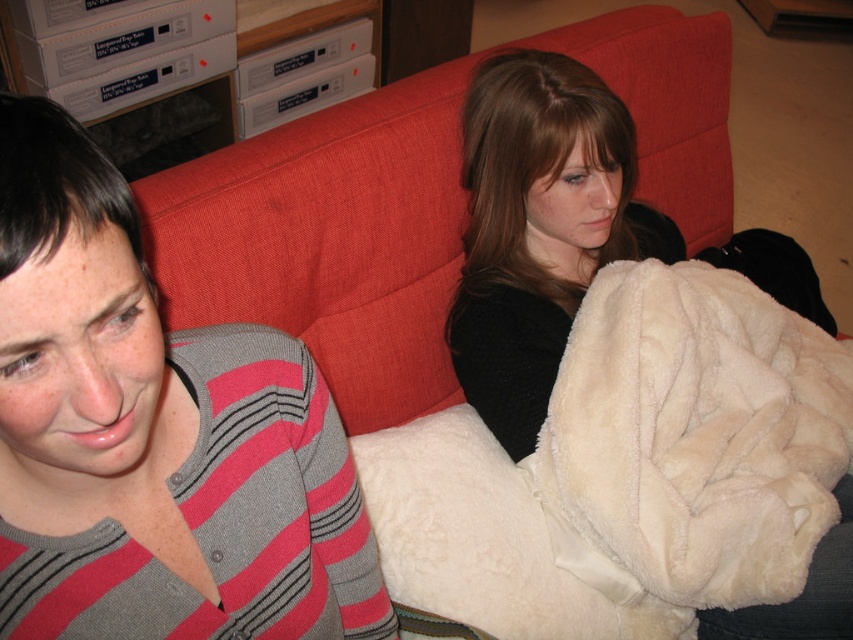
Please provide the coordinates of the gray striped sweater at left in the image.

The gray striped sweater at left is located at coordinates point (154,435).

You are a fashion designer observing the scene. You need to determine the spatial arrangement of the gray striped sweater at left and the white fluffy blanket at center. Which object is located to the left of the other?

The gray striped sweater at left is positioned on the left side of white fluffy blanket at center, so the gray striped sweater at left is to the left of the white fluffy blanket at center.

You are designing a layout for a magazine spread that needs to highlight both the gray striped sweater at left and the white fluffy blanket at center. Given their sizes in the image, which object should you place in a larger area to maintain visual balance?

The white fluffy blanket at center should be placed in a larger area because it occupies more space in the image than the gray striped sweater at left.